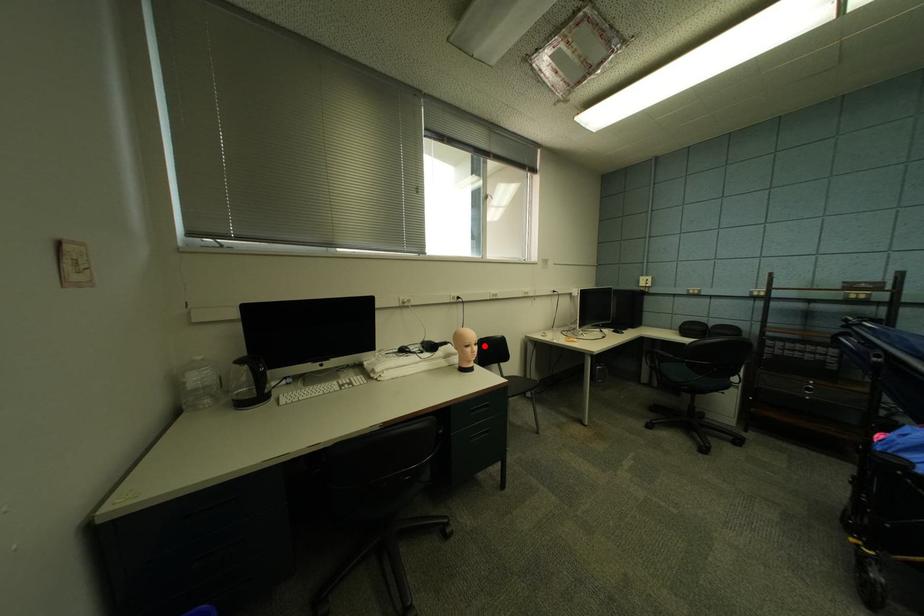
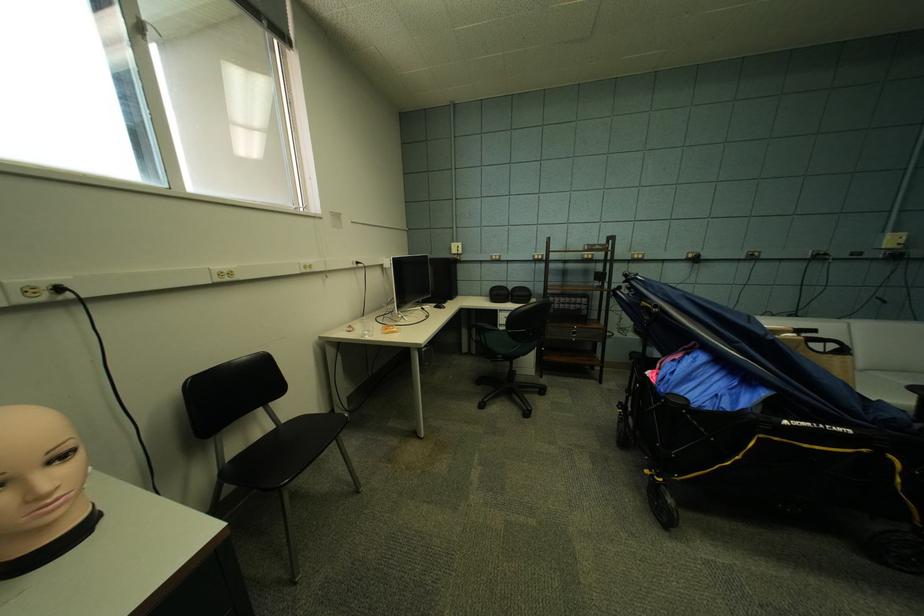
Locate, in the second image, the point that corresponds to the highlighted location in the first image.

(70, 459)